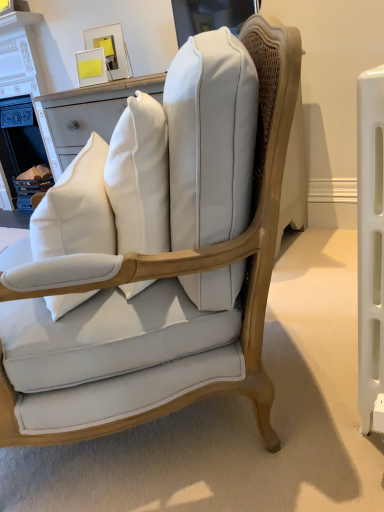
Question: Is matte white cushioned chair at center completely or partially outside of white cotton throw pillow at center?

Choices:
 (A) yes
 (B) no

Answer: (A)

Question: Is matte white cushioned chair at center shorter than white cotton throw pillow at center?

Choices:
 (A) no
 (B) yes

Answer: (A)

Question: Is the position of matte white cushioned chair at center less distant than that of white cotton throw pillow at center?

Choices:
 (A) yes
 (B) no

Answer: (A)

Question: Is matte white cushioned chair at center taller than white cotton throw pillow at center?

Choices:
 (A) yes
 (B) no

Answer: (A)

Question: Is matte white cushioned chair at center to the left of white cotton throw pillow at center from the viewer's perspective?

Choices:
 (A) yes
 (B) no

Answer: (B)

Question: Considering their positions, is white cotton throw pillow at center located in front of or behind matte white cushioned chair at center?

Choices:
 (A) behind
 (B) front

Answer: (A)

Question: Do you think white cotton throw pillow at center is within matte white cushioned chair at center, or outside of it?

Choices:
 (A) outside
 (B) inside

Answer: (B)

Question: Does point (79, 157) appear closer or farther from the camera than point (6, 379)?

Choices:
 (A) farther
 (B) closer

Answer: (A)

Question: From a real-world perspective, is white cotton throw pillow at center positioned above or below matte white cushioned chair at center?

Choices:
 (A) above
 (B) below

Answer: (A)

Question: From a real-world perspective, is white painted wood fireplace at upper left physically located above or below matte white cushioned chair at center?

Choices:
 (A) below
 (B) above

Answer: (B)

Question: Is white painted wood fireplace at upper left wider or thinner than matte white cushioned chair at center?

Choices:
 (A) wide
 (B) thin

Answer: (B)

Question: Considering the positions of point (6, 88) and point (251, 304), is point (6, 88) closer or farther from the camera than point (251, 304)?

Choices:
 (A) closer
 (B) farther

Answer: (B)

Question: In terms of size, does white painted wood fireplace at upper left appear bigger or smaller than matte white cushioned chair at center?

Choices:
 (A) big
 (B) small

Answer: (B)

Question: From the image's perspective, is white cotton throw pillow at center positioned above or below white painted wood fireplace at upper left?

Choices:
 (A) above
 (B) below

Answer: (B)

Question: Based on their sizes in the image, would you say white cotton throw pillow at center is bigger or smaller than white painted wood fireplace at upper left?

Choices:
 (A) big
 (B) small

Answer: (B)